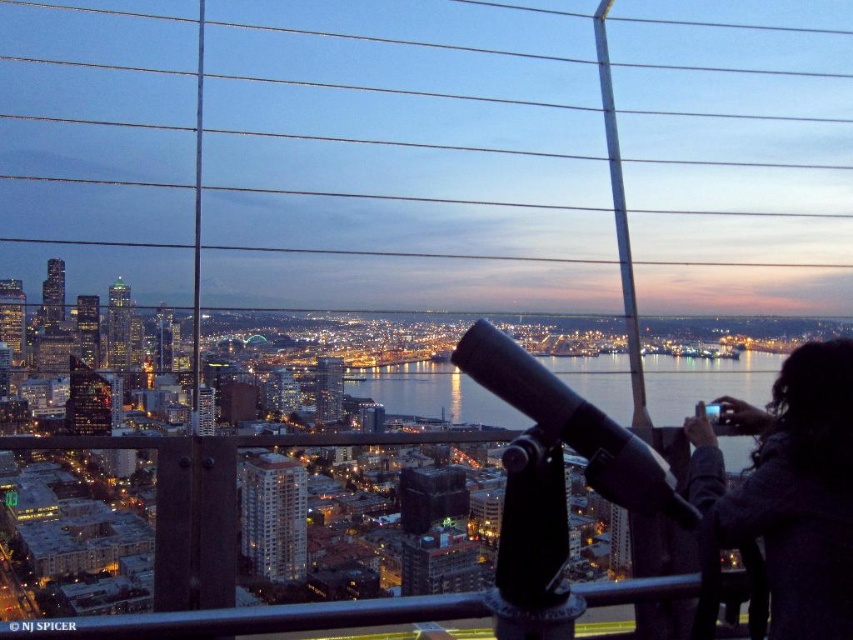
Question: Which of the following is the farthest from the observer?

Choices:
 (A) dark gray wool coat at lower right
 (B) black matte telescope at center

Answer: (A)

Question: Can you confirm if dark gray wool coat at lower right is positioned to the left of black matte telescope at center?

Choices:
 (A) no
 (B) yes

Answer: (A)

Question: Which of the following is the closest to the observer?

Choices:
 (A) (773, 547)
 (B) (544, 454)

Answer: (A)

Question: Which of the following is the farthest from the observer?

Choices:
 (A) black matte telescope at center
 (B) dark gray wool coat at lower right

Answer: (B)

Question: Does dark gray wool coat at lower right lie in front of black matte telescope at center?

Choices:
 (A) no
 (B) yes

Answer: (A)

Question: Is dark gray wool coat at lower right wider than black matte telescope at center?

Choices:
 (A) yes
 (B) no

Answer: (B)